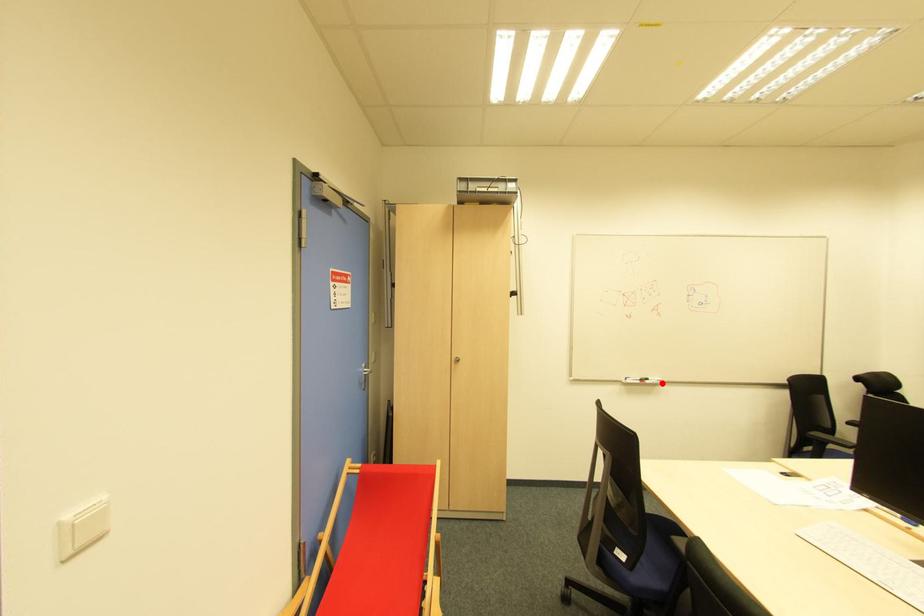
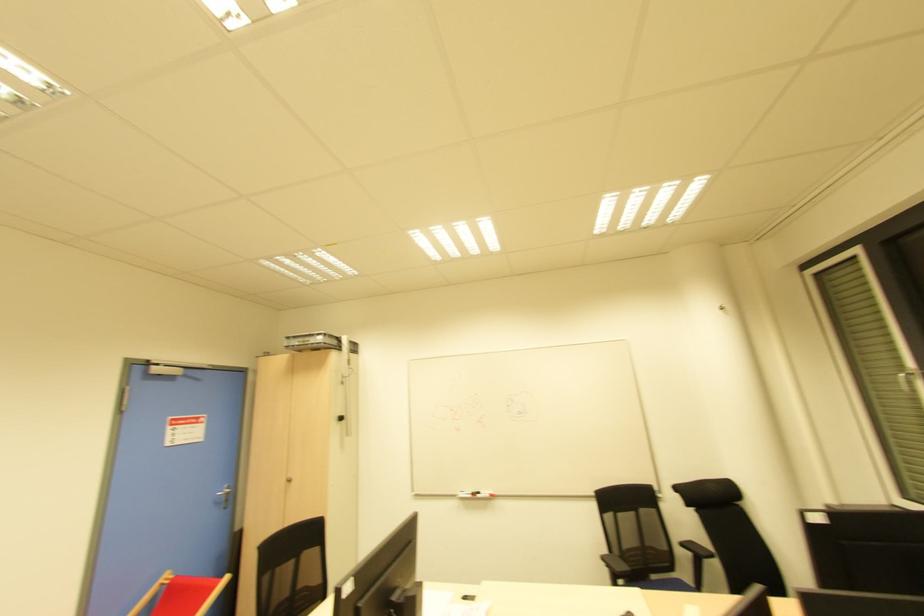
In the second image, find the point that corresponds to the highlighted location in the first image.

(492, 496)